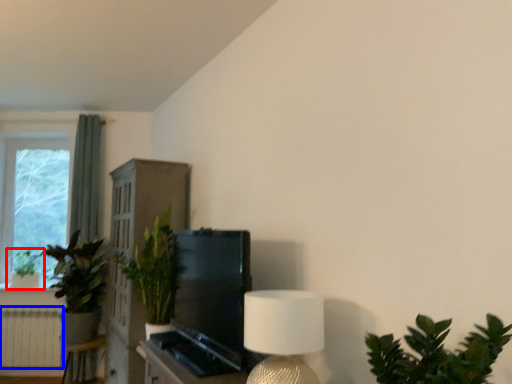
Question: Which object appears farthest to the camera in this image, houseplant (highlighted by a red box) or radiator (highlighted by a blue box)?

Choices:
 (A) houseplant
 (B) radiator

Answer: (A)